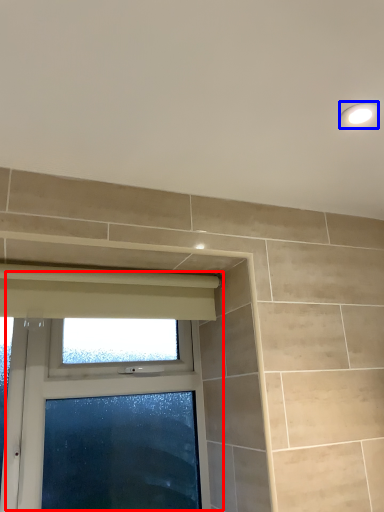
Question: Which point is further to the camera, window (highlighted by a red box) or light fixture (highlighted by a blue box)?

Choices:
 (A) window
 (B) light fixture

Answer: (A)